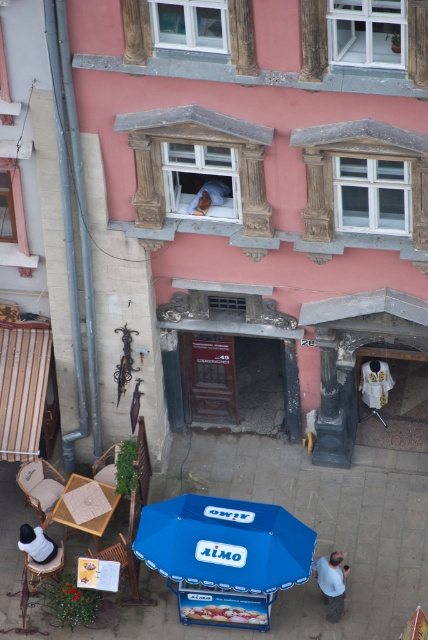
Between point (48, 522) and point (112, 556), which one is positioned in front?

Point (112, 556)

Between white fabric shirt at lower left and wooden chair at lower left, which one has less height?

With less height is white fabric shirt at lower left.

Where is `white fabric shirt at lower left`? This screenshot has width=428, height=640. white fabric shirt at lower left is located at coordinates (38, 541).

Find the location of `white fabric shirt at lower left`. white fabric shirt at lower left is located at coordinates (38, 541).

Consider the image. Can you confirm if light brown woven chair at lower left is positioned above white fabric shirt at lower left?

Indeed, light brown woven chair at lower left is positioned over white fabric shirt at lower left.

Does light brown woven chair at lower left lie in front of white fabric shirt at lower left?

No, it is behind white fabric shirt at lower left.

Is point (35, 474) farther from camera compared to point (39, 545)?

Yes, it is.

At what (x,y) coordinates should I click in order to perform the action: click on light brown woven chair at lower left. Please return your answer as a coordinate pair (x, y). Image resolution: width=428 pixels, height=640 pixels. Looking at the image, I should click on (39, 484).

Consider the image. Which is more to the right, blue fabric umbrella at lower center or light brown leather jacket at lower center?

light brown leather jacket at lower center is more to the right.

Is point (270, 563) behind point (329, 561)?

No, it is in front of (329, 561).

Is point (189, 563) positioned in front of point (332, 568)?

Yes, it is.

Locate an element on the screen. This screenshot has height=640, width=428. blue fabric umbrella at lower center is located at coordinates (225, 541).